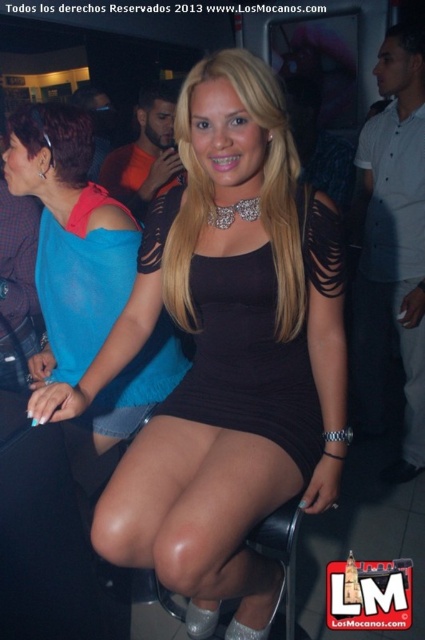
Question: Which of the following is the farthest from the observer?

Choices:
 (A) (192, 513)
 (B) (51, 330)
 (C) (155, 266)

Answer: (B)

Question: Which object appears closest to the camera in this image?

Choices:
 (A) blue sheer top at upper left
 (B) black ribbed dress at center
 (C) black matte dress at center

Answer: (C)

Question: Which point is farther to the camera?

Choices:
 (A) black matte dress at center
 (B) black ribbed dress at center
 (C) blue sheer top at upper left

Answer: (C)

Question: Does blue sheer top at upper left come behind black ribbed dress at center?

Choices:
 (A) yes
 (B) no

Answer: (A)

Question: Is blue sheer top at upper left positioned in front of black ribbed dress at center?

Choices:
 (A) no
 (B) yes

Answer: (A)

Question: Does black matte dress at center appear under black ribbed dress at center?

Choices:
 (A) yes
 (B) no

Answer: (A)